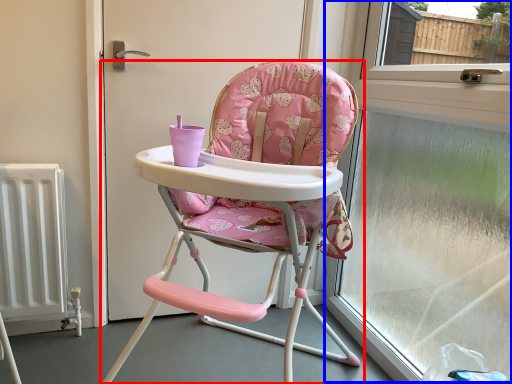
Question: Which point is closer to the camera, chair (highlighted by a red box) or window frame (highlighted by a blue box)?

Choices:
 (A) chair
 (B) window frame

Answer: (A)